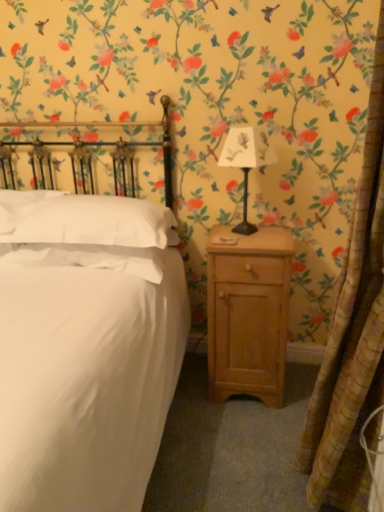
Question: Does metallic black lamp at center-right turn towards white soft pillow at upper left, the second pillow from the right?

Choices:
 (A) yes
 (B) no

Answer: (B)

Question: Considering the relative positions of metallic black lamp at center-right and white soft pillow at upper left, the second pillow from the right, in the image provided, is metallic black lamp at center-right to the right of white soft pillow at upper left, the second pillow from the right, from the viewer's perspective?

Choices:
 (A) no
 (B) yes

Answer: (B)

Question: Can you confirm if metallic black lamp at center-right is thinner than white soft pillow at upper left, marked as the 1th pillow in a left-to-right arrangement?

Choices:
 (A) no
 (B) yes

Answer: (B)

Question: Is metallic black lamp at center-right smaller than white soft pillow at upper left, marked as the 1th pillow in a left-to-right arrangement?

Choices:
 (A) yes
 (B) no

Answer: (A)

Question: From a real-world perspective, is metallic black lamp at center-right beneath white soft pillow at upper left, the second pillow from the right?

Choices:
 (A) yes
 (B) no

Answer: (B)

Question: From the image's perspective, does metallic black lamp at center-right appear higher than white soft pillow at upper left, the second pillow from the right?

Choices:
 (A) yes
 (B) no

Answer: (A)

Question: Can you confirm if white soft pillow at left, the 2th pillow when ordered from left to right, is positioned to the left of white soft pillow at upper left, the second pillow from the right?

Choices:
 (A) no
 (B) yes

Answer: (A)

Question: From a real-world perspective, does white soft pillow at left, which is the first pillow from right to left, stand above white soft pillow at upper left, marked as the 1th pillow in a left-to-right arrangement?

Choices:
 (A) no
 (B) yes

Answer: (B)

Question: Considering the relative sizes of white soft pillow at left, the 2th pillow when ordered from left to right, and white soft pillow at upper left, the second pillow from the right, in the image provided, is white soft pillow at left, the 2th pillow when ordered from left to right, smaller than white soft pillow at upper left, the second pillow from the right,?

Choices:
 (A) no
 (B) yes

Answer: (A)

Question: Is white soft pillow at left, which is the first pillow from right to left, shorter than white soft pillow at upper left, the second pillow from the right?

Choices:
 (A) no
 (B) yes

Answer: (B)

Question: Is white soft pillow at left, the 2th pillow when ordered from left to right, aimed at white soft pillow at upper left, the second pillow from the right?

Choices:
 (A) no
 (B) yes

Answer: (A)

Question: Is white soft pillow at left, the 2th pillow when ordered from left to right, taller than white soft pillow at upper left, the second pillow from the right?

Choices:
 (A) no
 (B) yes

Answer: (A)

Question: From the image's perspective, would you say white soft pillow at left, which is the first pillow from right to left, is shown under metallic black lamp at center-right?

Choices:
 (A) no
 (B) yes

Answer: (B)